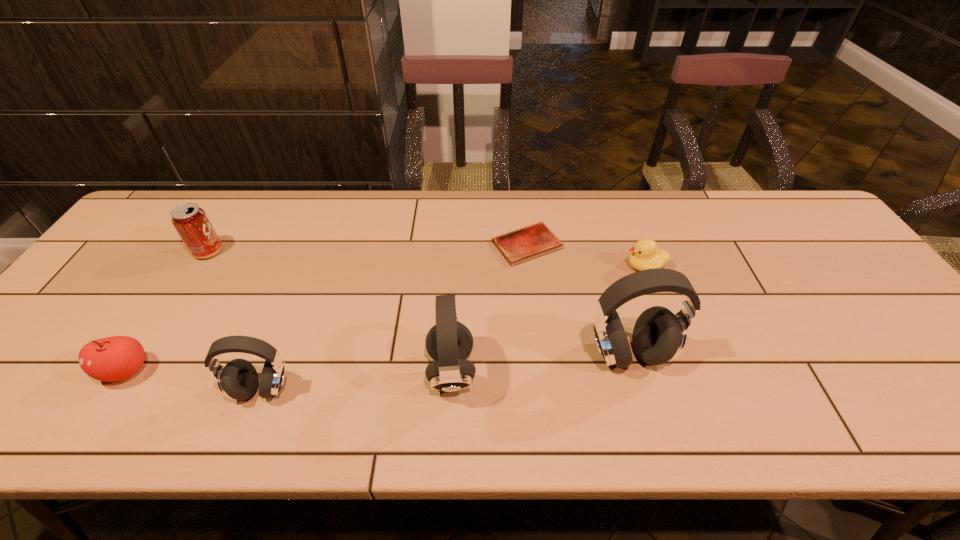
Locate an element on the screen. The image size is (960, 540). the shortest headset is located at coordinates click(238, 380).

The height and width of the screenshot is (540, 960). I want to click on the third object from left to right, so click(x=238, y=380).

In order to click on the second shortest headset in this screenshot , I will do `click(449, 342)`.

I want to click on the fourth object from right to left, so click(x=449, y=342).

The height and width of the screenshot is (540, 960). What are the coordinates of `the tallest object` in the screenshot? It's located at (659, 336).

Locate an element on the screen. This screenshot has width=960, height=540. the rightmost headset is located at coordinates (659, 336).

Where is `soda can`? This screenshot has height=540, width=960. soda can is located at coordinates (191, 222).

At what (x,y) coordinates should I click in order to perform the action: click on diary. Please return your answer as a coordinate pair (x, y). The image size is (960, 540). Looking at the image, I should click on (519, 246).

The height and width of the screenshot is (540, 960). Identify the location of the shortest object. (519, 246).

The height and width of the screenshot is (540, 960). I want to click on the second shortest object, so click(x=644, y=254).